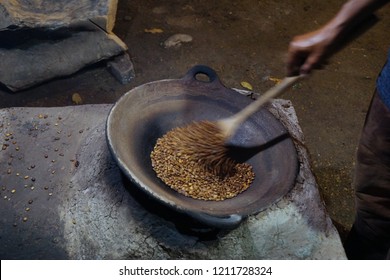
Where is `handles on pan`? handles on pan is located at coordinates (221, 224), (203, 70).